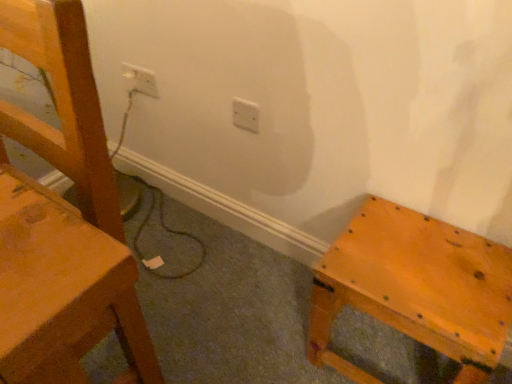
From the picture: Measure the distance between matte wood chair at left and camera.

The depth of matte wood chair at left is 13.39 inches.

The image size is (512, 384). Describe the element at coordinates (63, 219) in the screenshot. I see `matte wood chair at left` at that location.

How much space does white plastic electric outlet at center, which is the first electric outlet in bottom-to-top order, occupy vertically?

The height of white plastic electric outlet at center, which is the first electric outlet in bottom-to-top order, is 3.95 inches.

This screenshot has width=512, height=384. What do you see at coordinates (140, 80) in the screenshot?
I see `white plastic electric outlet at upper left, which appears as the 1th electric outlet when viewed from the left` at bounding box center [140, 80].

Locate an element on the screen. The height and width of the screenshot is (384, 512). matte wood chair at left is located at coordinates (63, 219).

From the image's perspective, is white plastic electric outlet at upper left, which appears as the 1th electric outlet when viewed from the left, located above or below matte wood chair at left?

Based on their image positions, white plastic electric outlet at upper left, which appears as the 1th electric outlet when viewed from the left, is located above matte wood chair at left.

Is white plastic electric outlet at upper left, placed as the 2th electric outlet when sorted from front to back, looking in the opposite direction of matte wood chair at left?

No, matte wood chair at left is not at the back of white plastic electric outlet at upper left, placed as the 2th electric outlet when sorted from front to back.

In the scene shown: From a real-world perspective, is white plastic electric outlet at upper left, placed as the second electric outlet when sorted from bottom to top, on matte wood chair at left?

No.

Could you tell me if white plastic electric outlet at upper left, placed as the second electric outlet when sorted from bottom to top, is turned towards matte wooden stool at lower right?

No.

From a real-world perspective, is white plastic electric outlet at upper left, which ranks as the 2th electric outlet in right-to-left order, physically above matte wooden stool at lower right?

Yes, from a real-world perspective, white plastic electric outlet at upper left, which ranks as the 2th electric outlet in right-to-left order, is on top of matte wooden stool at lower right.

Could you measure the distance between white plastic electric outlet at upper left, arranged as the 1th electric outlet when viewed from the back, and matte wooden stool at lower right?

A distance of 36.76 inches exists between white plastic electric outlet at upper left, arranged as the 1th electric outlet when viewed from the back, and matte wooden stool at lower right.

Is white plastic electric outlet at upper left, placed as the second electric outlet when sorted from bottom to top, next to matte wooden stool at lower right and touching it?

There is a gap between white plastic electric outlet at upper left, placed as the second electric outlet when sorted from bottom to top, and matte wooden stool at lower right.

Between point (146, 92) and point (248, 117), which one is positioned behind?

Positioned behind is point (146, 92).

Is white plastic electric outlet at upper left, placed as the second electric outlet when sorted from bottom to top, placed right next to white plastic electric outlet at center, which appears as the first electric outlet when viewed from the right?

No.

Does white plastic electric outlet at upper left, the first electric outlet in the top-to-bottom sequence, turn towards white plastic electric outlet at center, which appears as the second electric outlet when viewed from the left?

No.

Is matte wood chair at left taller than white plastic electric outlet at upper left, arranged as the 1th electric outlet when viewed from the back?

Yes, matte wood chair at left is taller than white plastic electric outlet at upper left, arranged as the 1th electric outlet when viewed from the back.

The height and width of the screenshot is (384, 512). Identify the location of chair below the white plastic electric outlet at upper left, the first electric outlet in the top-to-bottom sequence (from the image's perspective). (63, 219).

Between matte wood chair at left and white plastic electric outlet at upper left, placed as the 2th electric outlet when sorted from front to back, which one appears on the right side from the viewer's perspective?

white plastic electric outlet at upper left, placed as the 2th electric outlet when sorted from front to back.

How different are the orientations of matte wood chair at left and white plastic electric outlet at upper left, which ranks as the 2th electric outlet in right-to-left order, in degrees?

1.63 degrees separate the facing orientations of matte wood chair at left and white plastic electric outlet at upper left, which ranks as the 2th electric outlet in right-to-left order.

From the image's perspective, is white plastic electric outlet at center, which is the 2th electric outlet in top-to-bottom order, above or below matte wood chair at left?

Based on their image positions, white plastic electric outlet at center, which is the 2th electric outlet in top-to-bottom order, is located above matte wood chair at left.

From a real-world perspective, which object rests below the other?

white plastic electric outlet at center, which is the first electric outlet in bottom-to-top order, from a real-world perspective.

Who is taller, white plastic electric outlet at center, which appears as the second electric outlet when viewed from the left, or matte wood chair at left?

matte wood chair at left.

Is white plastic electric outlet at center, which appears as the first electric outlet when viewed from the right, touching matte wood chair at left?

No, white plastic electric outlet at center, which appears as the first electric outlet when viewed from the right, is not in contact with matte wood chair at left.

Is matte wooden stool at lower right inside the boundaries of matte wood chair at left, or outside?

matte wooden stool at lower right is located beyond the bounds of matte wood chair at left.

Which object is positioned more to the left, matte wooden stool at lower right or matte wood chair at left?

matte wood chair at left.

Is point (454, 309) closer to viewer compared to point (53, 12)?

No, it is behind (53, 12).

From the image's perspective, is matte wooden stool at lower right above or below matte wood chair at left?

Clearly, from the image's perspective, matte wooden stool at lower right is below matte wood chair at left.

Is matte wooden stool at lower right wider or thinner than white plastic electric outlet at upper left, arranged as the 1th electric outlet when viewed from the back?

Clearly, matte wooden stool at lower right has more width compared to white plastic electric outlet at upper left, arranged as the 1th electric outlet when viewed from the back.

Considering the sizes of objects matte wooden stool at lower right and white plastic electric outlet at upper left, arranged as the 1th electric outlet when viewed from the back, in the image provided, who is bigger, matte wooden stool at lower right or white plastic electric outlet at upper left, arranged as the 1th electric outlet when viewed from the back,?

matte wooden stool at lower right is bigger.

Considering the relative positions of matte wooden stool at lower right and white plastic electric outlet at upper left, which appears as the 1th electric outlet when viewed from the left, in the image provided, is matte wooden stool at lower right to the left of white plastic electric outlet at upper left, which appears as the 1th electric outlet when viewed from the left, from the viewer's perspective?

No, matte wooden stool at lower right is not to the left of white plastic electric outlet at upper left, which appears as the 1th electric outlet when viewed from the left.

Is matte wooden stool at lower right aimed at white plastic electric outlet at upper left, placed as the 2th electric outlet when sorted from front to back?

No, matte wooden stool at lower right is not facing towards white plastic electric outlet at upper left, placed as the 2th electric outlet when sorted from front to back.

Locate an element on the screen. chair located on the left of white plastic electric outlet at upper left, placed as the 2th electric outlet when sorted from front to back is located at coordinates [63, 219].

This screenshot has width=512, height=384. Find the location of `furniture below the white plastic electric outlet at upper left, placed as the 2th electric outlet when sorted from front to back (from a real-world perspective)`. furniture below the white plastic electric outlet at upper left, placed as the 2th electric outlet when sorted from front to back (from a real-world perspective) is located at coordinates (415, 288).

Which object lies nearer to the anchor point matte wooden stool at lower right, white plastic electric outlet at upper left, which appears as the 1th electric outlet when viewed from the left, or matte wood chair at left?

Based on the image, matte wood chair at left appears to be nearer to matte wooden stool at lower right.

In the scene shown: From the image, which object appears to be farther from matte wooden stool at lower right, white plastic electric outlet at center, which is the 2th electric outlet in top-to-bottom order, or white plastic electric outlet at upper left, placed as the second electric outlet when sorted from bottom to top?

Among the two, white plastic electric outlet at upper left, placed as the second electric outlet when sorted from bottom to top, is located further to matte wooden stool at lower right.

Estimate the real-world distances between objects in this image. Which object is further from matte wooden stool at lower right, white plastic electric outlet at center, the second electric outlet when ordered from back to front, or matte wood chair at left?

white plastic electric outlet at center, the second electric outlet when ordered from back to front, is further to matte wooden stool at lower right.

From the image, which object appears to be nearer to white plastic electric outlet at upper left, which appears as the 1th electric outlet when viewed from the left, matte wood chair at left or matte wooden stool at lower right?

matte wood chair at left lies closer to white plastic electric outlet at upper left, which appears as the 1th electric outlet when viewed from the left, than the other object.

From the image, which object appears to be farther from white plastic electric outlet at center, the second electric outlet when ordered from back to front, white plastic electric outlet at upper left, arranged as the 1th electric outlet when viewed from the back, or matte wooden stool at lower right?

matte wooden stool at lower right is further to white plastic electric outlet at center, the second electric outlet when ordered from back to front.

Looking at the image, which one is located closer to matte wood chair at left, white plastic electric outlet at upper left, the first electric outlet in the top-to-bottom sequence, or matte wooden stool at lower right?

matte wooden stool at lower right lies closer to matte wood chair at left than the other object.

Based on their spatial positions, is white plastic electric outlet at upper left, the first electric outlet in the top-to-bottom sequence, or white plastic electric outlet at center, which appears as the first electric outlet when viewed from the right, further from matte wooden stool at lower right?

white plastic electric outlet at upper left, the first electric outlet in the top-to-bottom sequence, is further to matte wooden stool at lower right.

Considering their positions, is white plastic electric outlet at center, the second electric outlet when ordered from back to front, positioned closer to matte wood chair at left than matte wooden stool at lower right?

matte wooden stool at lower right is closer to matte wood chair at left.

This screenshot has height=384, width=512. What are the coordinates of `electric outlet located between white plastic electric outlet at upper left, which appears as the 1th electric outlet when viewed from the left, and matte wooden stool at lower right in the left-right direction` in the screenshot? It's located at (245, 115).

In order to click on electric outlet located between matte wood chair at left and white plastic electric outlet at upper left, the first electric outlet in the top-to-bottom sequence, in the depth direction in this screenshot , I will do `click(245, 115)`.

Identify the location of furniture positioned between matte wood chair at left and white plastic electric outlet at center, which is the 2th electric outlet in top-to-bottom order, from near to far. 415,288.

You are a GUI agent. You are given a task and a screenshot of the screen. Output one action in this format:
    pyautogui.click(x=<x>, y=<y>)
    Task: Click on the furniture between matte wood chair at left and white plastic electric outlet at upper left, which ranks as the 2th electric outlet in right-to-left order, in the front-back direction
    The width and height of the screenshot is (512, 384).
    Given the screenshot: What is the action you would take?
    pyautogui.click(x=415, y=288)